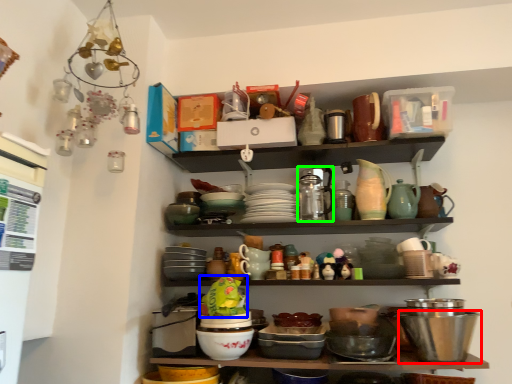
Question: Which is farther away from bowl (highlighted by a red box)? food (highlighted by a blue box) or tableware (highlighted by a green box)?

Choices:
 (A) food
 (B) tableware

Answer: (A)